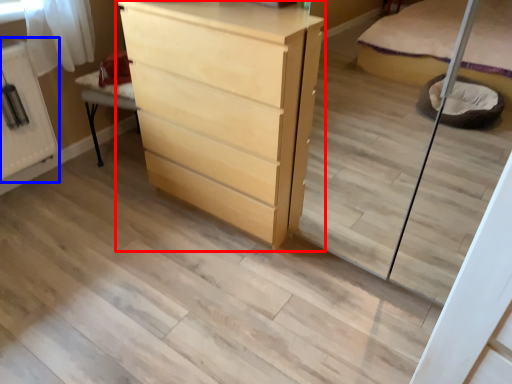
Question: Which of the following is the closest to the observer, chest of drawers (highlighted by a red box) or cabinetry (highlighted by a blue box)?

Choices:
 (A) chest of drawers
 (B) cabinetry

Answer: (A)